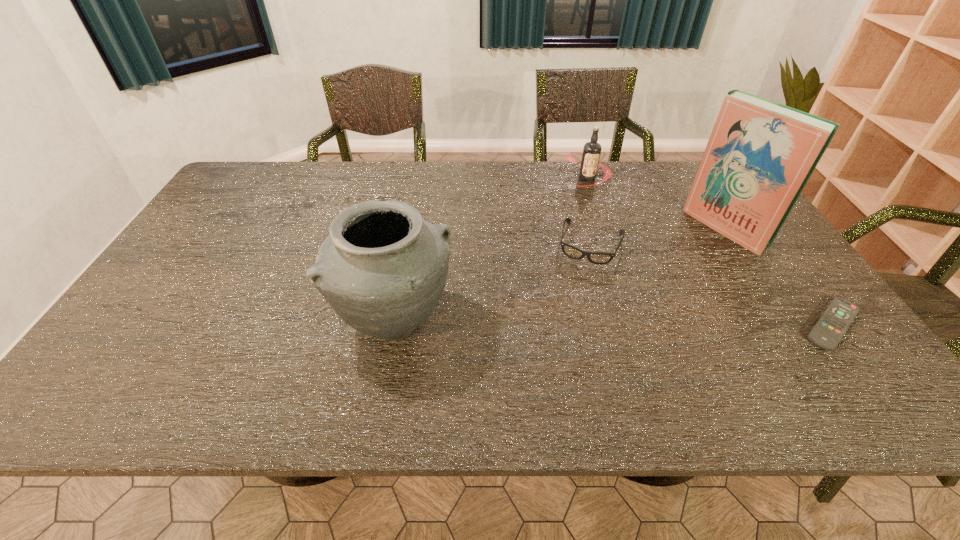
In order to click on the leftmost object in this screenshot , I will do `click(382, 268)`.

This screenshot has height=540, width=960. Find the location of `the second tallest object`. the second tallest object is located at coordinates (382, 268).

Identify the location of remote control. This screenshot has height=540, width=960. (828, 331).

Locate an element on the screen. hardback book is located at coordinates (760, 155).

Find the location of a particular element. This screenshot has height=540, width=960. the fourth tallest object is located at coordinates (599, 258).

Find the location of a particular element. root beer is located at coordinates (591, 153).

I want to click on the farthest object, so click(591, 153).

Locate an element on the screen. The height and width of the screenshot is (540, 960). free region located on the left of the second tallest object is located at coordinates (245, 323).

This screenshot has width=960, height=540. I want to click on vacant space located on the left of the shortest object, so click(742, 325).

Find the location of a particular element. This screenshot has width=960, height=540. vacant region located 0.050m on the cover of the hardback book is located at coordinates click(696, 251).